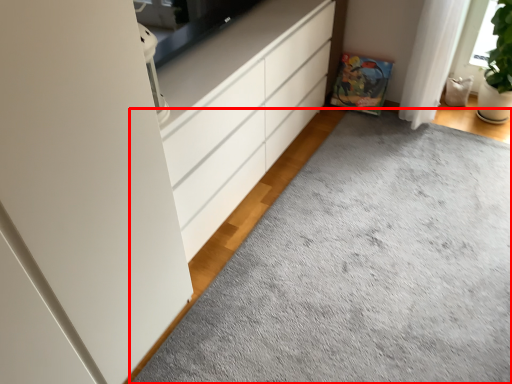
Question: In this image, where is plain (annotated by the red box) located relative to chest of drawers?

Choices:
 (A) left
 (B) right

Answer: (B)